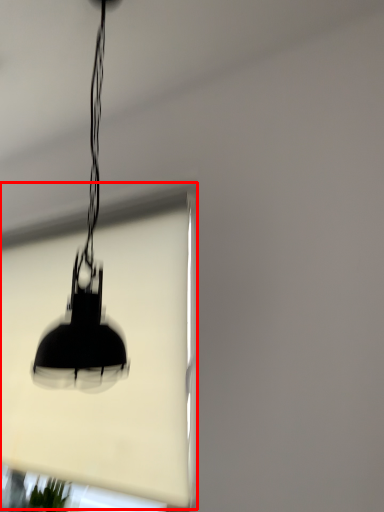
Question: Observing the image, what is the correct spatial positioning of window screen (annotated by the red box) in reference to lamp?

Choices:
 (A) left
 (B) right

Answer: (A)